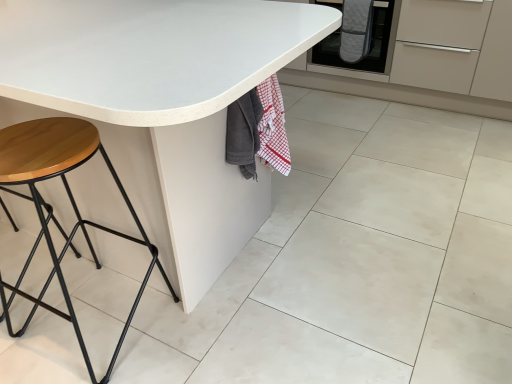
The image size is (512, 384). In order to click on free space above white matte granite at center (from a real-world perspective) in this screenshot , I will do `click(360, 310)`.